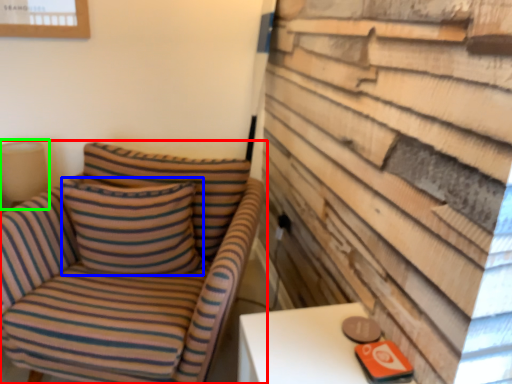
Question: Based on their relative distances, which object is farther from chair (highlighted by a red box)? Choose from pillow (highlighted by a blue box) and table lamp (highlighted by a green box).

Choices:
 (A) pillow
 (B) table lamp

Answer: (B)